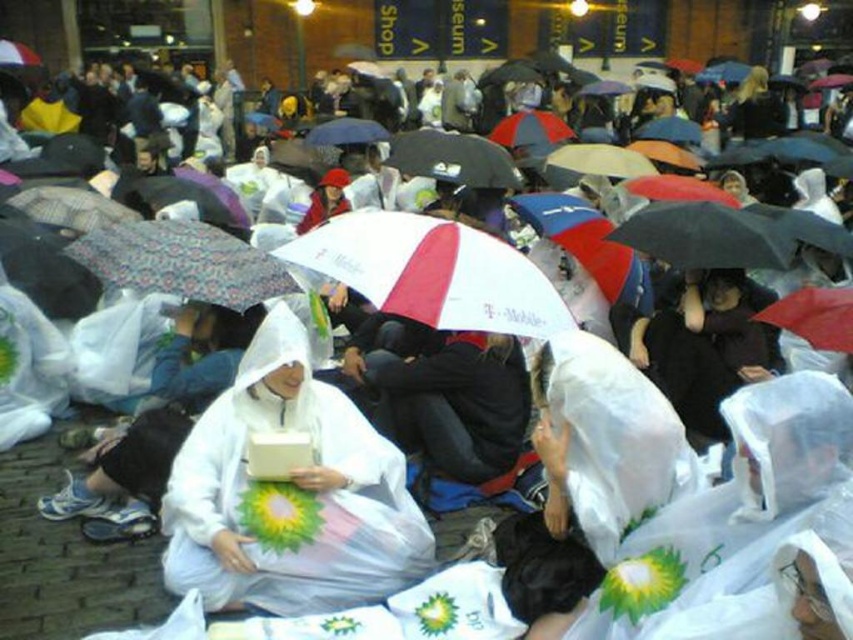
Does white matte raincoat at center have a larger size compared to whitematerialumbrella at center?

Actually, white matte raincoat at center might be smaller than whitematerialumbrella at center.

In the scene shown: Is white matte raincoat at center above whitematerialumbrella at center?

Incorrect, white matte raincoat at center is not positioned above whitematerialumbrella at center.

Is point (189, 536) positioned after point (488, 262)?

No.

The width and height of the screenshot is (853, 640). Identify the location of white matte raincoat at center. (289, 496).

Does white matte raincoat at center appear on the right side of patterned fabric umbrella at center?

Yes, white matte raincoat at center is to the right of patterned fabric umbrella at center.

Does white matte raincoat at center have a larger size compared to patterned fabric umbrella at center?

Yes, white matte raincoat at center is bigger than patterned fabric umbrella at center.

This screenshot has width=853, height=640. I want to click on white matte raincoat at center, so click(x=289, y=496).

Between point (416, 276) and point (260, 278), which one is positioned behind?

The point (260, 278) is behind.

Locate an element on the screen. whitematerialumbrella at center is located at coordinates (433, 273).